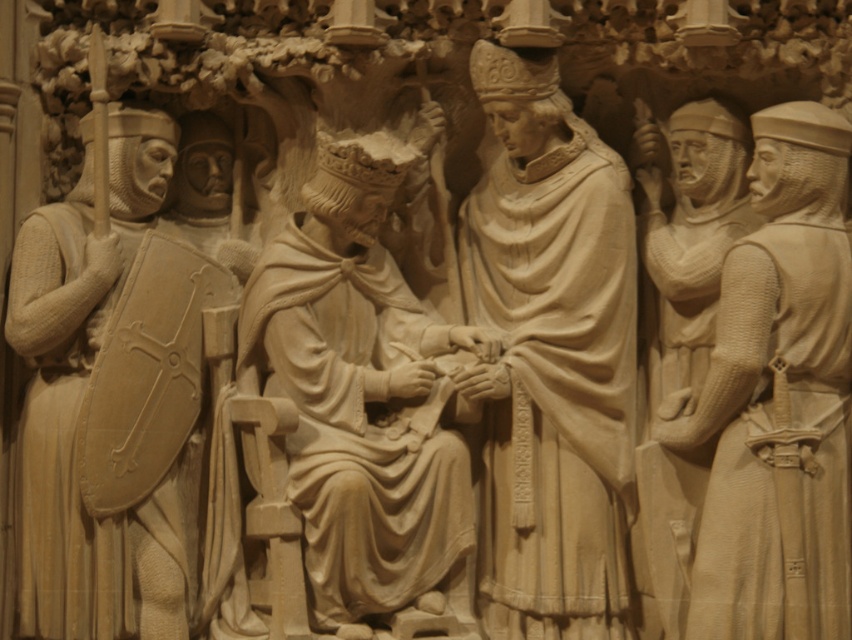
In the historical stone relief sculpture, there are beige stone soldiers at right and beige stone knight at left. Which of these two figures is wider in the depiction?

The beige stone soldiers at right are wider than the beige stone knight at left according to the description.

You are standing at a point 14.32 meters away from the relief sculpture. If you want to touch the point labeled as point (314, 246) on the relief, can you reach it without moving closer?

The point (314, 246) is 14.32 meters away from the viewer. Since you are already at that distance, you cannot reach it without moving closer.